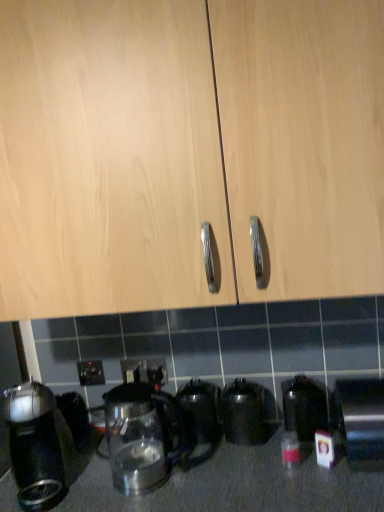
Question: Is black plastic electric outlet at lower center, which ranks as the first electric outlet in left-to-right order, further to the viewer compared to transparent glass kettle at lower center, marked as the 5th kitchen appliance in a right-to-left arrangement?

Choices:
 (A) yes
 (B) no

Answer: (A)

Question: Does black plastic electric outlet at lower center, the third electric outlet viewed from the right, appear on the right side of transparent glass kettle at lower center, the second kitchen appliance when ordered from left to right?

Choices:
 (A) no
 (B) yes

Answer: (A)

Question: Is black plastic electric outlet at lower center, the third electric outlet viewed from the right, positioned before transparent glass kettle at lower center, marked as the 5th kitchen appliance in a right-to-left arrangement?

Choices:
 (A) yes
 (B) no

Answer: (B)

Question: From a real-world perspective, is black plastic electric outlet at lower center, which ranks as the first electric outlet in left-to-right order, on top of transparent glass kettle at lower center, marked as the 5th kitchen appliance in a right-to-left arrangement?

Choices:
 (A) yes
 (B) no

Answer: (A)

Question: Is transparent glass kettle at lower center, marked as the 5th kitchen appliance in a right-to-left arrangement, at the back of black plastic electric outlet at lower center, the third electric outlet viewed from the right?

Choices:
 (A) yes
 (B) no

Answer: (B)

Question: Considering the relative positions of black plastic electric outlet at lower center, the third electric outlet viewed from the right, and transparent glass kettle at lower center, the second kitchen appliance when ordered from left to right, in the image provided, is black plastic electric outlet at lower center, the third electric outlet viewed from the right, to the left of transparent glass kettle at lower center, the second kitchen appliance when ordered from left to right, from the viewer's perspective?

Choices:
 (A) yes
 (B) no

Answer: (A)

Question: Is satin silver toaster at lower right, which ranks as the 1th kitchen appliance in right-to-left order, shorter than translucent glass bottle at lower right?

Choices:
 (A) yes
 (B) no

Answer: (B)

Question: Does satin silver toaster at lower right, which ranks as the 1th kitchen appliance in right-to-left order, appear on the right side of translucent glass bottle at lower right?

Choices:
 (A) no
 (B) yes

Answer: (B)

Question: Can you confirm if satin silver toaster at lower right, which ranks as the 1th kitchen appliance in right-to-left order, is bigger than translucent glass bottle at lower right?

Choices:
 (A) no
 (B) yes

Answer: (B)

Question: Could you tell me if satin silver toaster at lower right, which ranks as the 1th kitchen appliance in right-to-left order, is facing translucent glass bottle at lower right?

Choices:
 (A) yes
 (B) no

Answer: (B)

Question: Is translucent glass bottle at lower right surrounded by satin silver toaster at lower right, which is the 6th kitchen appliance from left to right?

Choices:
 (A) yes
 (B) no

Answer: (B)

Question: From the image's perspective, does satin silver toaster at lower right, which is the 6th kitchen appliance from left to right, appear lower than translucent glass bottle at lower right?

Choices:
 (A) no
 (B) yes

Answer: (A)

Question: Does satin silver toaster at lower right, which is the 6th kitchen appliance from left to right, have a greater height compared to transparent glass kettle at center, which appears as the 4th kitchen appliance when viewed from the right?

Choices:
 (A) yes
 (B) no

Answer: (A)